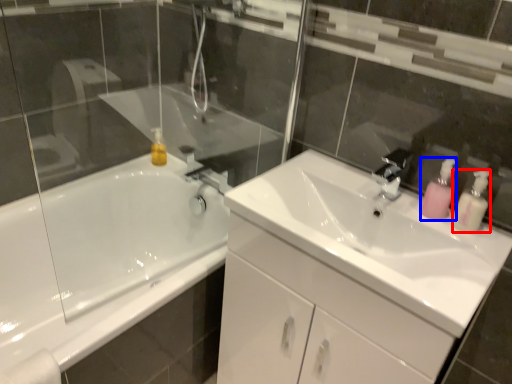
Question: Among these objects, which one is nearest to the camera, soap dispenser (highlighted by a red box) or soap dispenser (highlighted by a blue box)?

Choices:
 (A) soap dispenser
 (B) soap dispenser

Answer: (A)